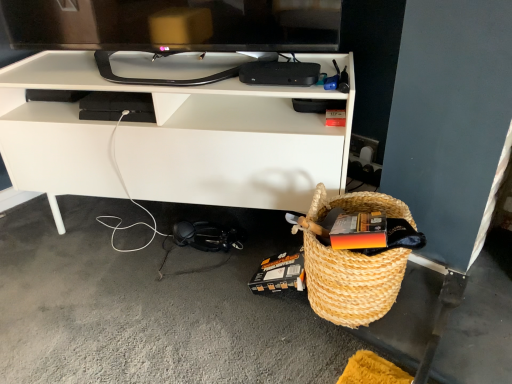
In the scene shown: What is the approximate width of white matte desk at center?

white matte desk at center is 19.12 inches in width.

In order to face black glossy tv at upper center, should I rotate leftwards or rightwards?

To align with it, rotate left about 11.613°.

This screenshot has height=384, width=512. What are the coordinates of `black glossy tv at upper center` in the screenshot? It's located at (172, 28).

Where is `natural woven picnic basket at lower right`? natural woven picnic basket at lower right is located at coordinates (351, 282).

The width and height of the screenshot is (512, 384). I want to click on white matte desk at center, so click(173, 139).

Find the location of a particular element. Image resolution: width=512 pixels, height=384 pixels. picnic basket located in front of the black glossy tv at upper center is located at coordinates (351, 282).

Which of these two, black glossy tv at upper center or natural woven picnic basket at lower right, stands shorter?

With less height is black glossy tv at upper center.

Between point (184, 41) and point (344, 297), which one is positioned in front?

Positioned in front is point (344, 297).

Is black glossy tv at upper center looking in the opposite direction of natural woven picnic basket at lower right?

No, black glossy tv at upper center is not facing away from natural woven picnic basket at lower right.

From a real-world perspective, is white matte desk at center positioned under black glossy tv at upper center based on gravity?

Yes.

Which of these two, white matte desk at center or black glossy tv at upper center, is wider?

With larger width is white matte desk at center.

How much distance is there between white matte desk at center and black glossy tv at upper center?

They are 21.98 centimeters apart.

Is white matte desk at center smaller than black glossy tv at upper center?

No.

Is black glossy tv at upper center facing away from white matte desk at center?

black glossy tv at upper center does not have its back to white matte desk at center.

Which of these two, black glossy tv at upper center or white matte desk at center, stands taller?

white matte desk at center is taller.

Is natural woven picnic basket at lower right completely or partially inside white matte desk at center?

No, natural woven picnic basket at lower right is located outside of white matte desk at center.

Is white matte desk at center oriented away from natural woven picnic basket at lower right?

No, white matte desk at center's orientation is not away from natural woven picnic basket at lower right.

Is white matte desk at center placed right next to natural woven picnic basket at lower right?

No.

Considering the relative positions of white matte desk at center and natural woven picnic basket at lower right in the image provided, is white matte desk at center behind natural woven picnic basket at lower right?

Yes, it is.

Does natural woven picnic basket at lower right lie behind white matte desk at center?

No.

Is natural woven picnic basket at lower right smaller than white matte desk at center?

Yes.

Looking at their sizes, would you say natural woven picnic basket at lower right is wider or thinner than white matte desk at center?

Clearly, natural woven picnic basket at lower right has less width compared to white matte desk at center.

In terms of height, does natural woven picnic basket at lower right look taller or shorter compared to white matte desk at center?

Clearly, natural woven picnic basket at lower right is shorter compared to white matte desk at center.

Is natural woven picnic basket at lower right oriented towards black glossy tv at upper center?

No, natural woven picnic basket at lower right is not facing towards black glossy tv at upper center.

This screenshot has width=512, height=384. What are the coordinates of `television that appears above the natural woven picnic basket at lower right (from a real-world perspective)` in the screenshot? It's located at (172, 28).

Is natural woven picnic basket at lower right spatially inside black glossy tv at upper center, or outside of it?

natural woven picnic basket at lower right is not enclosed by black glossy tv at upper center.

From the picture: From a real-world perspective, who is located lower, natural woven picnic basket at lower right or black glossy tv at upper center?

In real-world perspective, natural woven picnic basket at lower right is lower.

This screenshot has width=512, height=384. I want to click on television above the natural woven picnic basket at lower right (from a real-world perspective), so click(x=172, y=28).

This screenshot has width=512, height=384. Identify the location of television above the white matte desk at center (from the image's perspective). (172, 28).

Estimate the real-world distances between objects in this image. Which object is closer to white matte desk at center, natural woven picnic basket at lower right or black glossy tv at upper center?

black glossy tv at upper center lies closer to white matte desk at center than the other object.

Considering their positions, is black glossy tv at upper center positioned further to natural woven picnic basket at lower right than white matte desk at center?

Based on the image, black glossy tv at upper center appears to be further to natural woven picnic basket at lower right.

Which object lies nearer to the anchor point natural woven picnic basket at lower right, white matte desk at center or black glossy tv at upper center?

white matte desk at center lies closer to natural woven picnic basket at lower right than the other object.

Which object lies further to the anchor point black glossy tv at upper center, natural woven picnic basket at lower right or white matte desk at center?

natural woven picnic basket at lower right lies further to black glossy tv at upper center than the other object.

Estimate the real-world distances between objects in this image. Which object is closer to black glossy tv at upper center, white matte desk at center or natural woven picnic basket at lower right?

Based on the image, white matte desk at center appears to be nearer to black glossy tv at upper center.

Estimate the real-world distances between objects in this image. Which object is closer to white matte desk at center, black glossy tv at upper center or natural woven picnic basket at lower right?

black glossy tv at upper center is closer to white matte desk at center.

Find the location of a particular element. The image size is (512, 384). desk that lies between black glossy tv at upper center and natural woven picnic basket at lower right from top to bottom is located at coordinates (173, 139).